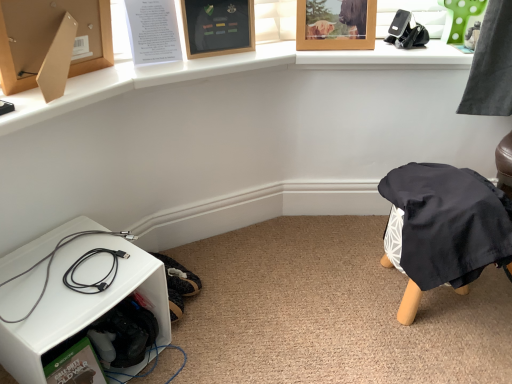
Question: Is black plastic phone holder at upper right further to camera compared to wooden picture frame at upper center, the first picture frame when ordered from right to left?

Choices:
 (A) no
 (B) yes

Answer: (B)

Question: Considering the relative sizes of black plastic phone holder at upper right and wooden picture frame at upper center, the first picture frame when ordered from right to left, in the image provided, is black plastic phone holder at upper right wider than wooden picture frame at upper center, the first picture frame when ordered from right to left,?

Choices:
 (A) no
 (B) yes

Answer: (B)

Question: Is the position of black plastic phone holder at upper right less distant than that of wooden picture frame at upper center, the first picture frame when ordered from right to left?

Choices:
 (A) no
 (B) yes

Answer: (A)

Question: Would you say black plastic phone holder at upper right is a long distance from wooden picture frame at upper center, the first picture frame when ordered from right to left?

Choices:
 (A) no
 (B) yes

Answer: (A)

Question: From the image's perspective, is black plastic phone holder at upper right located beneath wooden picture frame at upper center, positioned as the 2th picture frame in left-to-right order?

Choices:
 (A) no
 (B) yes

Answer: (B)

Question: Is wooden picture frame at upper center, positioned as the 2th picture frame in left-to-right order, completely or partially inside black plastic phone holder at upper right?

Choices:
 (A) yes
 (B) no

Answer: (B)

Question: From the image's perspective, is white plastic shelf at lower left on top of wooden picture frame at upper center, positioned as the 2th picture frame in left-to-right order?

Choices:
 (A) yes
 (B) no

Answer: (B)

Question: Are white plastic shelf at lower left and wooden picture frame at upper center, positioned as the 2th picture frame in left-to-right order, far apart?

Choices:
 (A) no
 (B) yes

Answer: (A)

Question: Considering the relative positions of white plastic shelf at lower left and wooden picture frame at upper center, the first picture frame when ordered from right to left, in the image provided, is white plastic shelf at lower left behind wooden picture frame at upper center, the first picture frame when ordered from right to left,?

Choices:
 (A) yes
 (B) no

Answer: (B)

Question: Is white plastic shelf at lower left outside of wooden picture frame at upper center, the first picture frame when ordered from right to left?

Choices:
 (A) yes
 (B) no

Answer: (A)

Question: Can you confirm if white plastic shelf at lower left is smaller than wooden picture frame at upper center, positioned as the 2th picture frame in left-to-right order?

Choices:
 (A) yes
 (B) no

Answer: (B)

Question: Is white plastic shelf at lower left placed right next to wooden picture frame at upper center, the first picture frame when ordered from right to left?

Choices:
 (A) yes
 (B) no

Answer: (B)

Question: Can you confirm if black cable at lower left is wider than wooden picture frame at upper center, the 2th picture frame when ordered from right to left?

Choices:
 (A) yes
 (B) no

Answer: (A)